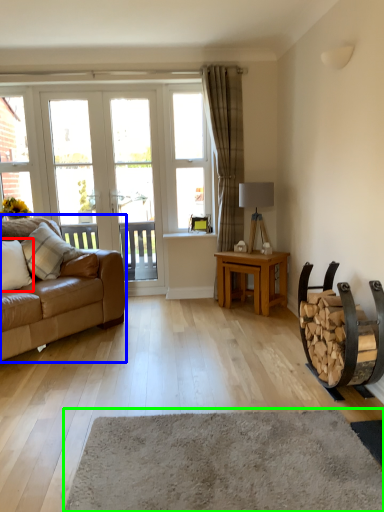
Question: Which object is the farthest from pillow (highlighted by a red box)? Choose among these: studio couch (highlighted by a blue box) or plain (highlighted by a green box).

Choices:
 (A) studio couch
 (B) plain

Answer: (B)